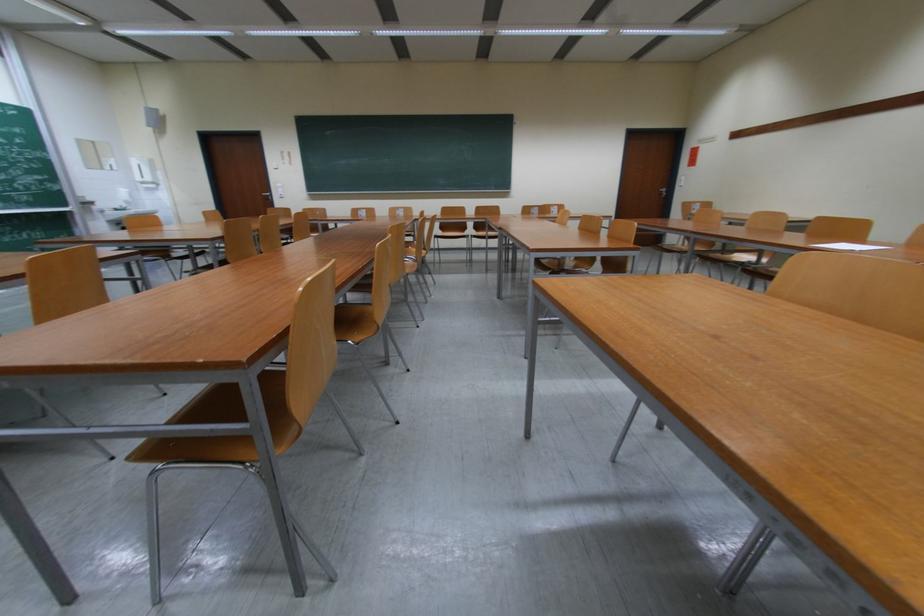
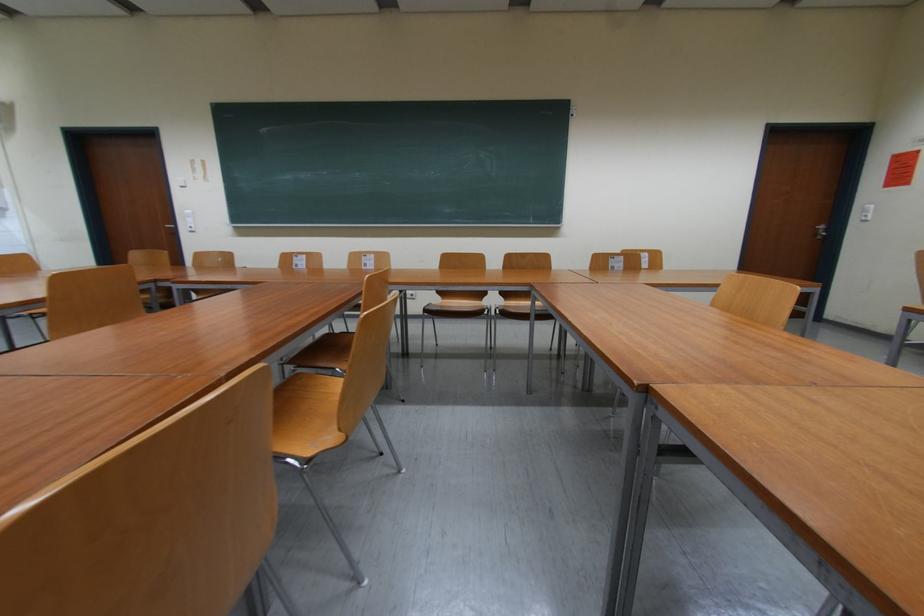
Question: The images are taken continuously from a first-person perspective. In which direction are you moving?

Choices:
 (A) Left
 (B) Right
 (C) Forward
 (D) Backward

Answer: (C)